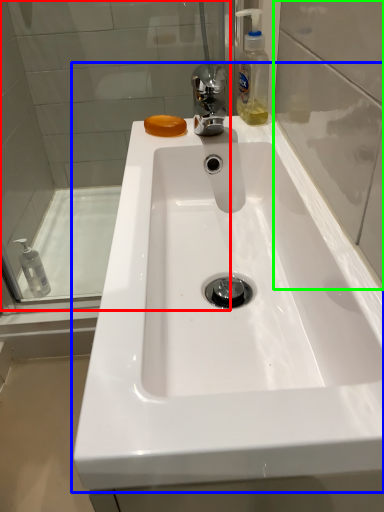
Question: Which is farther away from shower door (highlighted by a red box)? sink (highlighted by a blue box) or glass door (highlighted by a green box)?

Choices:
 (A) sink
 (B) glass door

Answer: (B)